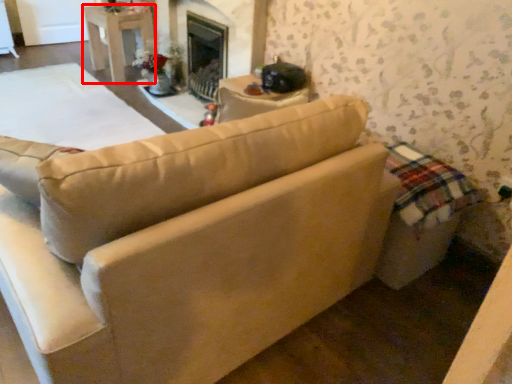
Question: From the image's perspective, where is table (annotated by the red box) located relative to studio couch?

Choices:
 (A) below
 (B) above

Answer: (B)